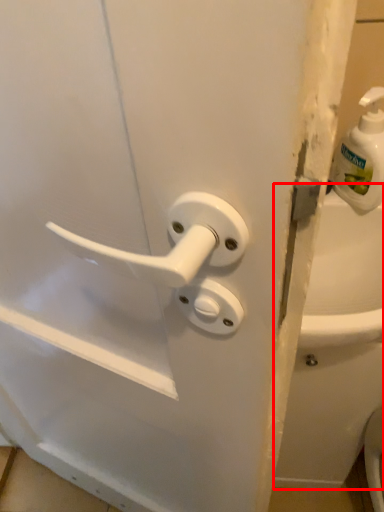
Question: From the image, what is the correct spatial relationship of bath (annotated by the red box) in relation to soap dispenser?

Choices:
 (A) right
 (B) left

Answer: (A)